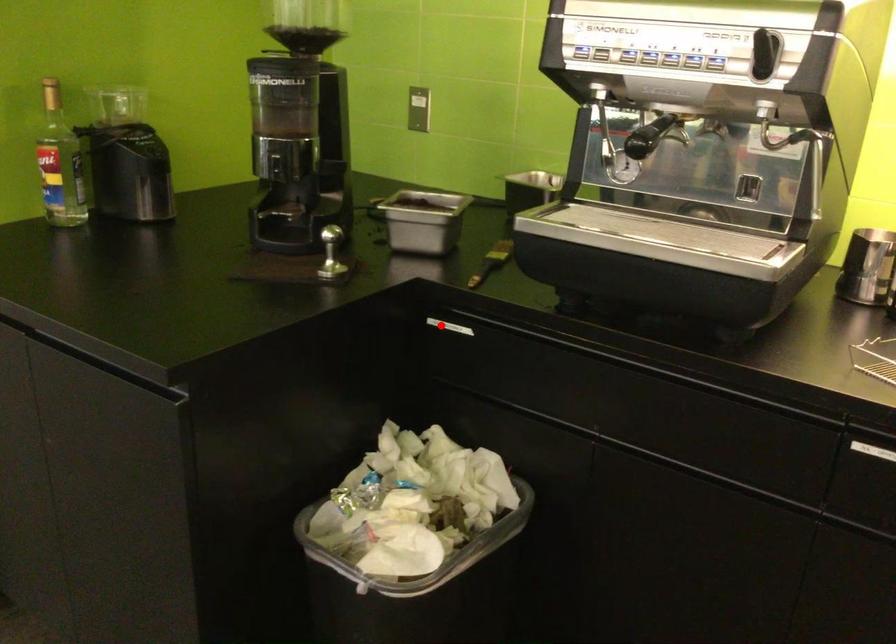
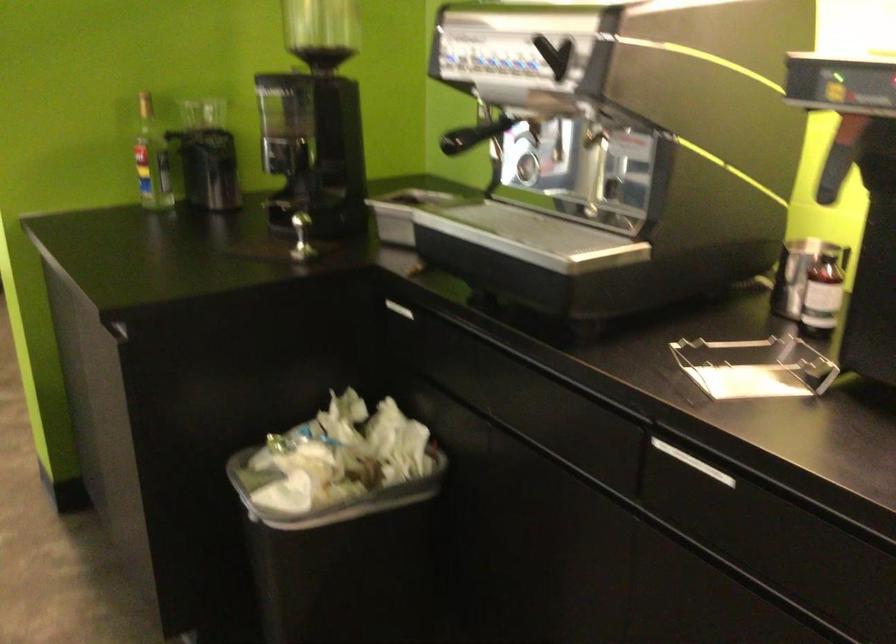
The point at the highlighted location is marked in the first image. Where is the corresponding point in the second image?

(394, 308)